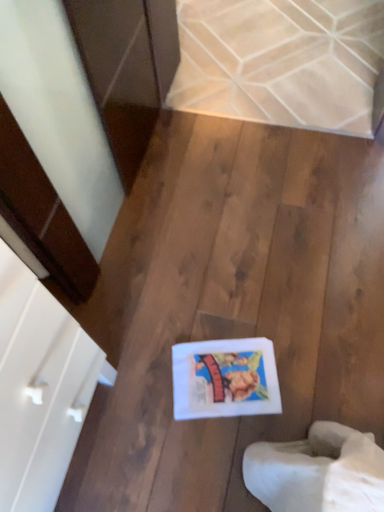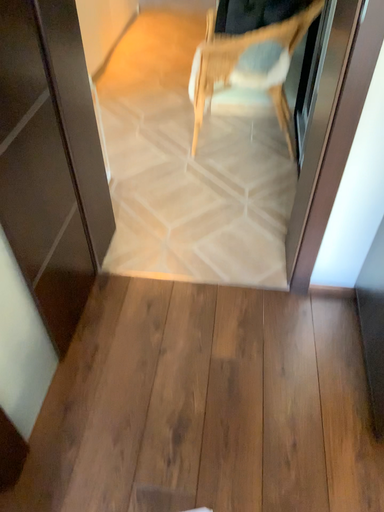
Question: How did the camera likely rotate when shooting the video?

Choices:
 (A) rotated downward
 (B) rotated upward

Answer: (B)